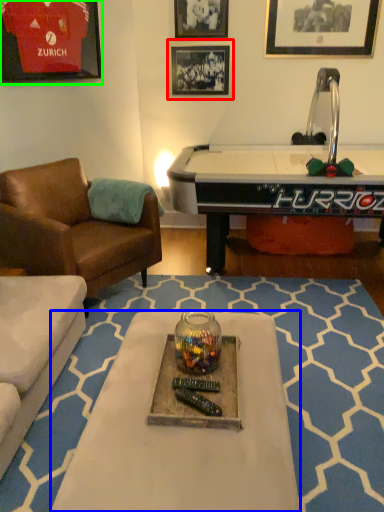
Question: Which object is the closest to the picture frame (highlighted by a red box)? Choose among these: table (highlighted by a blue box) or picture frame (highlighted by a green box).

Choices:
 (A) table
 (B) picture frame

Answer: (B)